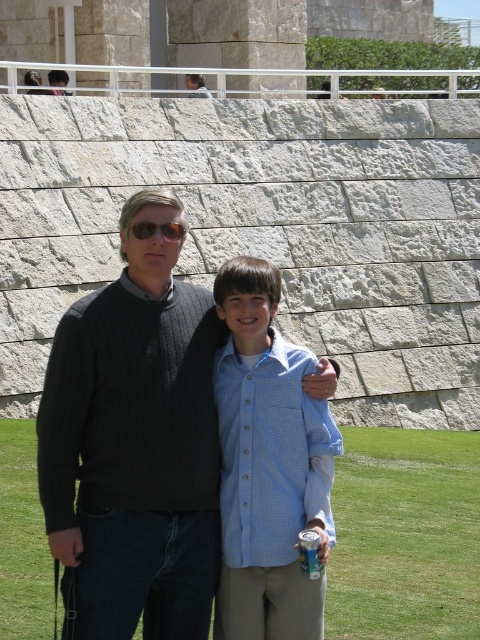
From the picture: Does light blue button-down shirt at center appear on the left side of matte black sunglasses at upper center?

No, light blue button-down shirt at center is not to the left of matte black sunglasses at upper center.

Is light blue button-down shirt at center closer to camera compared to matte black sunglasses at upper center?

No, it is behind matte black sunglasses at upper center.

Is point (324, 417) positioned behind point (143, 225)?

Yes, point (324, 417) is behind point (143, 225).

At what (x,y) coordinates should I click in order to perform the action: click on light blue button-down shirt at center. Please return your answer as a coordinate pair (x, y). This screenshot has height=640, width=480. Looking at the image, I should click on (265, 464).

Does point (253, 406) come closer to viewer compared to point (319, 545)?

No, (253, 406) is further to viewer.

Is light blue button-down shirt at center to the left of clear plastic can at lower center from the viewer's perspective?

Yes, light blue button-down shirt at center is to the left of clear plastic can at lower center.

Is point (237, 401) farther from viewer compared to point (304, 536)?

That is True.

Image resolution: width=480 pixels, height=640 pixels. I want to click on light blue button-down shirt at center, so click(x=265, y=464).

Can you confirm if clear plastic can at lower center is positioned to the right of matte black sunglasses at upper center?

Correct, you'll find clear plastic can at lower center to the right of matte black sunglasses at upper center.

Is the position of clear plastic can at lower center less distant than that of matte black sunglasses at upper center?

That is True.

Does point (302, 550) lie in front of point (141, 232)?

That is True.

Identify the location of clear plastic can at lower center. (310, 552).